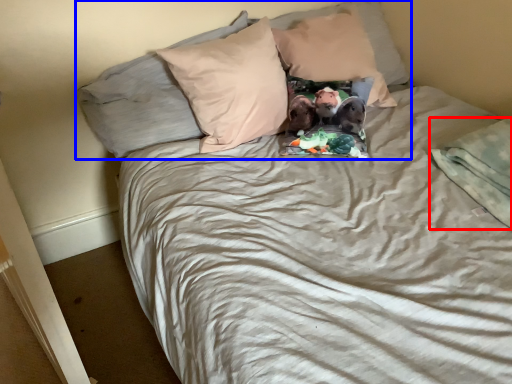
Question: Which object is further to the camera taking this photo, blanket (highlighted by a red box) or pillow (highlighted by a blue box)?

Choices:
 (A) blanket
 (B) pillow

Answer: (B)